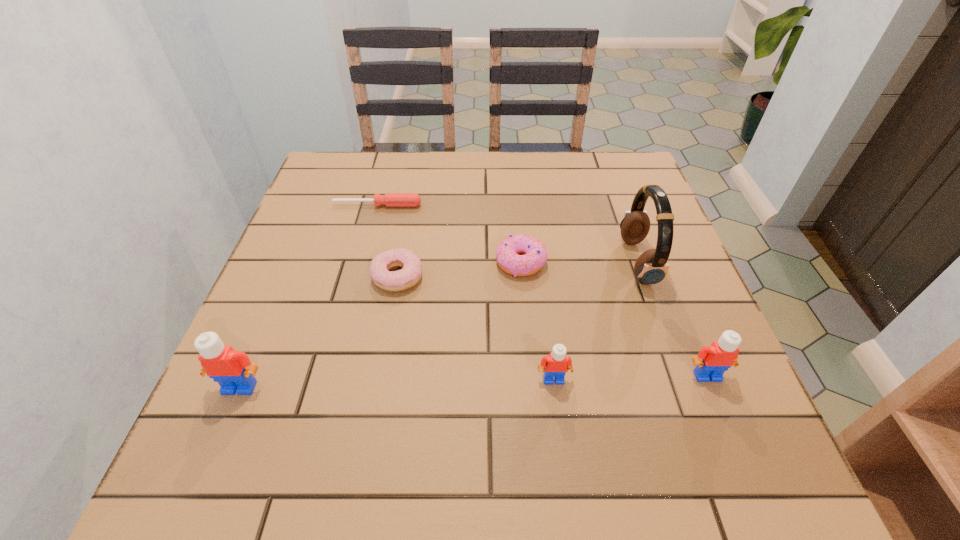
I want to click on the right doughnut, so click(535, 254).

You are a GUI agent. You are given a task and a screenshot of the screen. Output one action in this format:
    pyautogui.click(x=<x>, y=<y>)
    Task: Click on the shorter doughnut
    The height and width of the screenshot is (540, 960).
    Given the screenshot: What is the action you would take?
    pyautogui.click(x=410, y=274)

Identify the location of the second shortest object. (410, 274).

Find the location of `free point located on the right of the farthest object`. free point located on the right of the farthest object is located at coordinates (452, 205).

Find the location of a particular element. Image resolution: width=960 pixels, height=540 pixels. free space located on the ear cup of the headset is located at coordinates (449, 262).

Where is `free space located 0.300m on the ear cup of the headset`? free space located 0.300m on the ear cup of the headset is located at coordinates (493, 262).

Locate an element on the screen. This screenshot has width=960, height=540. blank area located on the ear cup of the headset is located at coordinates (567, 262).

At what (x,y) coordinates should I click in order to perform the action: click on free space located 0.350m on the left of the taller doughnut. Please return your answer as a coordinate pair (x, y). Looking at the image, I should click on (344, 262).

I want to click on vacant area situated on the back of the left doughnut, so click(x=406, y=227).

Identify the location of Lego situated at the left edge. This screenshot has width=960, height=540. (234, 372).